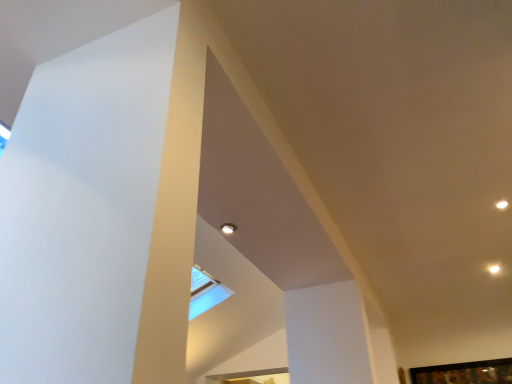
Describe the element at coordinates (228, 228) in the screenshot. I see `matte white light at upper center` at that location.

Locate an element on the screen. The width and height of the screenshot is (512, 384). matte white light at upper center is located at coordinates (228, 228).

Identify the location of matte white light at upper center. coord(228,228).